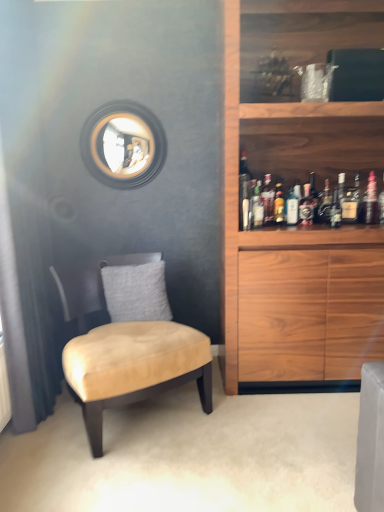
Question: Considering the relative positions of translucent glass bottle at upper right, acting as the 8th bottle starting from the right, and translucent glass bottle at upper right, which is the eighth bottle from left to right, in the image provided, is translucent glass bottle at upper right, acting as the 8th bottle starting from the right, to the left of translucent glass bottle at upper right, which is the eighth bottle from left to right, from the viewer's perspective?

Choices:
 (A) yes
 (B) no

Answer: (A)

Question: From a real-world perspective, is translucent glass bottle at upper right, acting as the 8th bottle starting from the right, on top of translucent glass bottle at upper right, which is the eighth bottle from left to right?

Choices:
 (A) yes
 (B) no

Answer: (A)

Question: From the image's perspective, does translucent glass bottle at upper right, the 2th bottle positioned from the left, appear higher than translucent glass bottle at upper right, which is the eighth bottle from left to right?

Choices:
 (A) no
 (B) yes

Answer: (B)

Question: Is translucent glass bottle at upper right, acting as the 8th bottle starting from the right, not close to translucent glass bottle at upper right, which is the eighth bottle from left to right?

Choices:
 (A) yes
 (B) no

Answer: (B)

Question: Is the position of translucent glass bottle at upper right, the 2th bottle positioned from the left, more distant than that of translucent glass bottle at upper right, positioned as the second bottle in right-to-left order?

Choices:
 (A) no
 (B) yes

Answer: (B)

Question: Can you confirm if translucent glass bottle at upper right, the 2th bottle positioned from the left, is wider than translucent glass bottle at upper right, positioned as the second bottle in right-to-left order?

Choices:
 (A) yes
 (B) no

Answer: (A)

Question: Can you confirm if translucent glass bottle at shelf center, the fourth bottle viewed from the left, is thinner than translucent glass bottle at upper right, the 2th bottle positioned from the left?

Choices:
 (A) yes
 (B) no

Answer: (A)

Question: Is translucent glass bottle at upper right, the 2th bottle positioned from the left, surrounded by translucent glass bottle at shelf center, the fourth bottle viewed from the left?

Choices:
 (A) yes
 (B) no

Answer: (B)

Question: From a real-world perspective, is translucent glass bottle at shelf center, the fourth bottle viewed from the left, physically above translucent glass bottle at upper right, the 2th bottle positioned from the left?

Choices:
 (A) yes
 (B) no

Answer: (B)

Question: Does translucent glass bottle at shelf center, which is the sixth bottle in right-to-left order, appear on the right side of translucent glass bottle at upper right, acting as the 8th bottle starting from the right?

Choices:
 (A) yes
 (B) no

Answer: (A)

Question: Is the position of translucent glass bottle at shelf center, which is the sixth bottle in right-to-left order, less distant than that of translucent glass bottle at upper right, acting as the 8th bottle starting from the right?

Choices:
 (A) no
 (B) yes

Answer: (A)

Question: Is translucent glass bottle at upper right, the 2th bottle positioned from the left, at the back of translucent glass bottle at shelf center, which is the sixth bottle in right-to-left order?

Choices:
 (A) yes
 (B) no

Answer: (B)

Question: From a real-world perspective, is translucent glass bottle at upper right, which is the sixth bottle from left to right, on top of translucent glass bottle at upper right, the 2th bottle positioned from the left?

Choices:
 (A) yes
 (B) no

Answer: (B)